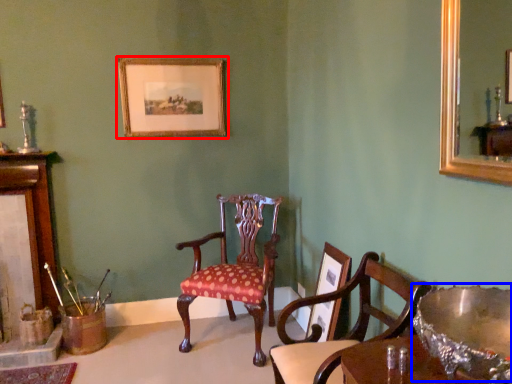
Question: Which point is closer to the camera, picture frame (highlighted by a red box) or glass bowl (highlighted by a blue box)?

Choices:
 (A) picture frame
 (B) glass bowl

Answer: (B)